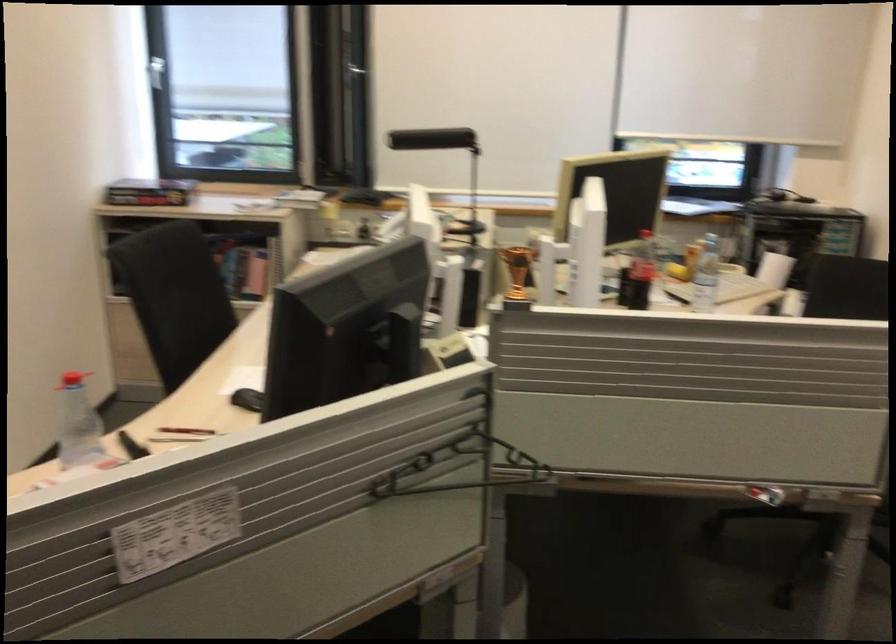
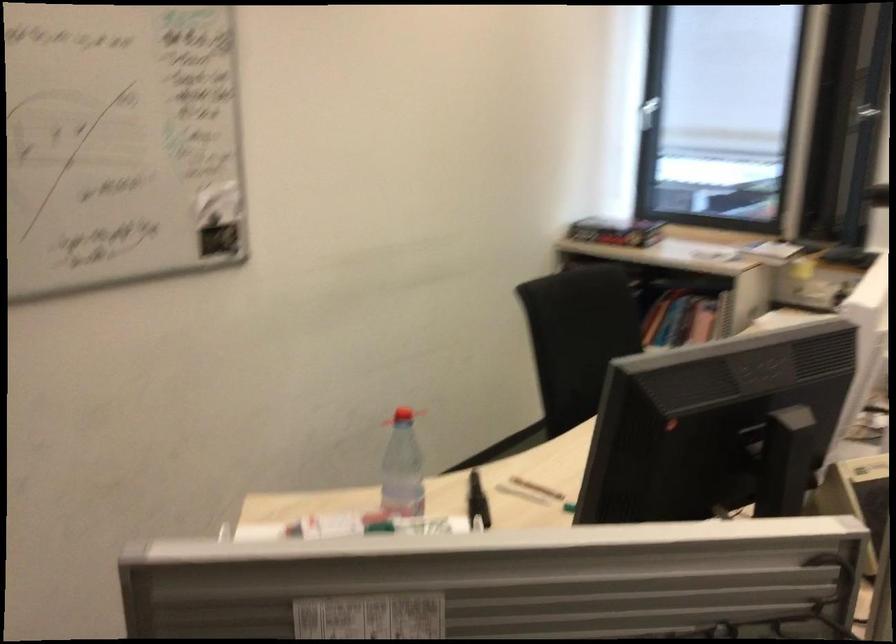
In the second image, find the point that corresponds to point (158, 196) in the first image.

(615, 232)